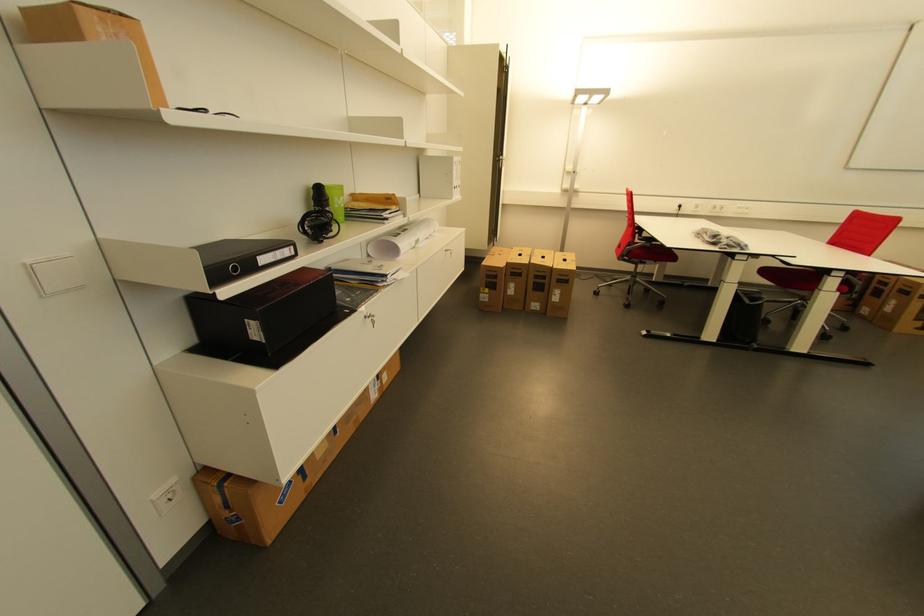
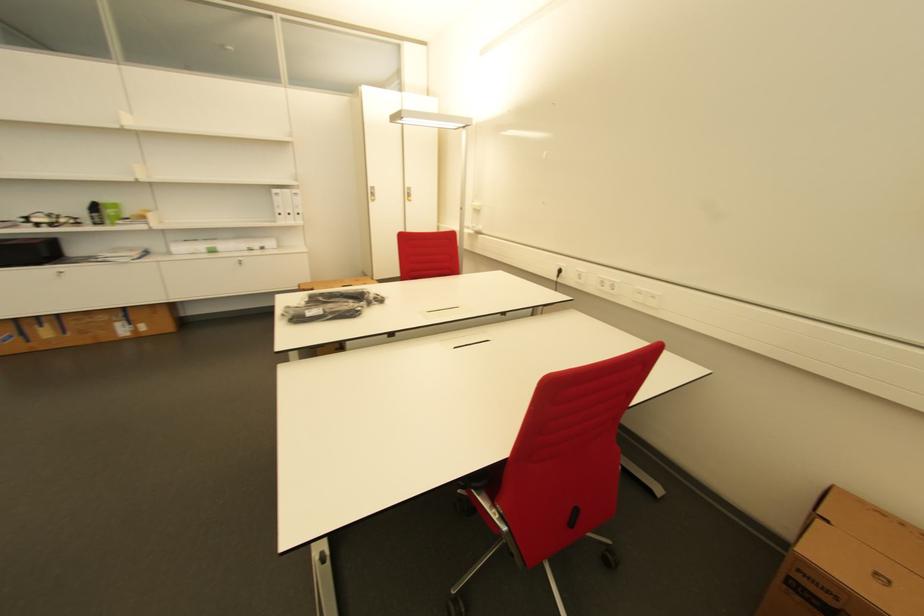
In the second image, find the point that corresponds to point 333,193 in the first image.

(104, 208)